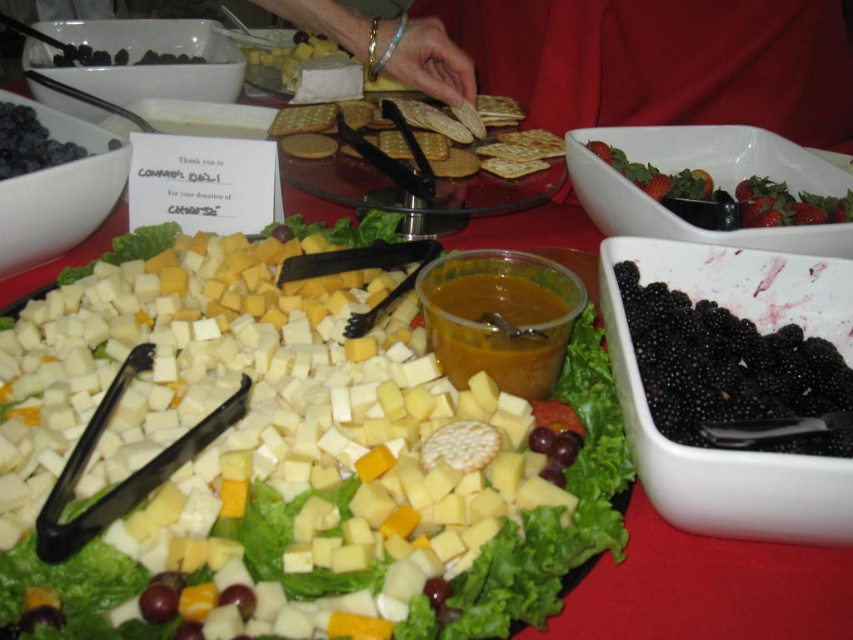
Question: Is white crumbly cheese at center bigger than black glossy/blackberry at lower right?

Choices:
 (A) no
 (B) yes

Answer: (B)

Question: Is black glossy/blackberry at lower right above blueberry at upper left?

Choices:
 (A) yes
 (B) no

Answer: (B)

Question: Which of the following is the farthest from the observer?

Choices:
 (A) blueberry at upper left
 (B) red glossy strawberries at upper right
 (C) white crumbly cheese at center

Answer: (A)

Question: Which object is the closest to the red glossy strawberries at upper right?

Choices:
 (A) black glossy/blackberry at lower right
 (B) blueberry at upper left

Answer: (A)

Question: Estimate the real-world distances between objects in this image. Which object is farther from the red glossy strawberries at upper right?

Choices:
 (A) black glossy/blackberry at lower right
 (B) white crumbly cheese at center
 (C) blueberry at upper left

Answer: (C)

Question: Can you confirm if black glossy/blackberry at lower right is positioned below red glossy strawberries at upper right?

Choices:
 (A) yes
 (B) no

Answer: (A)